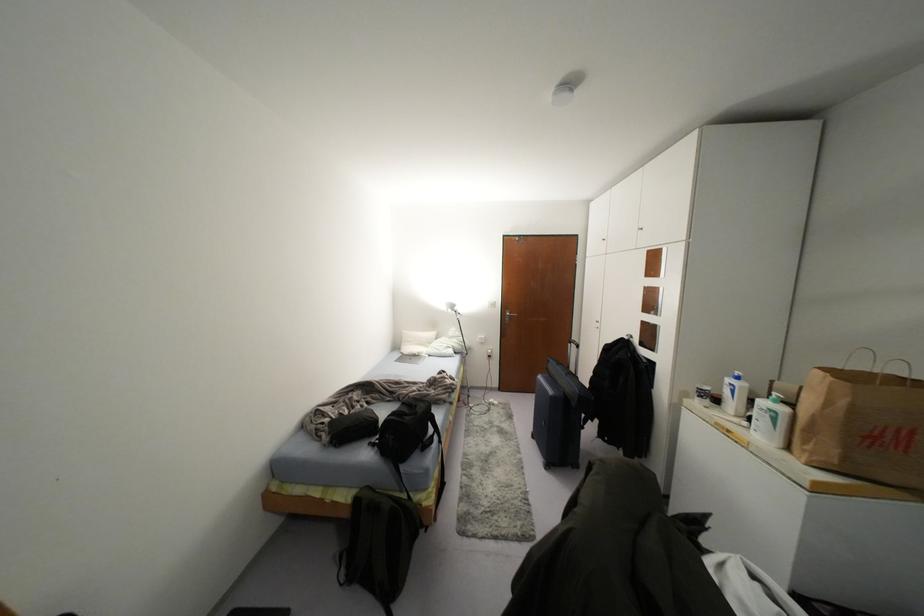
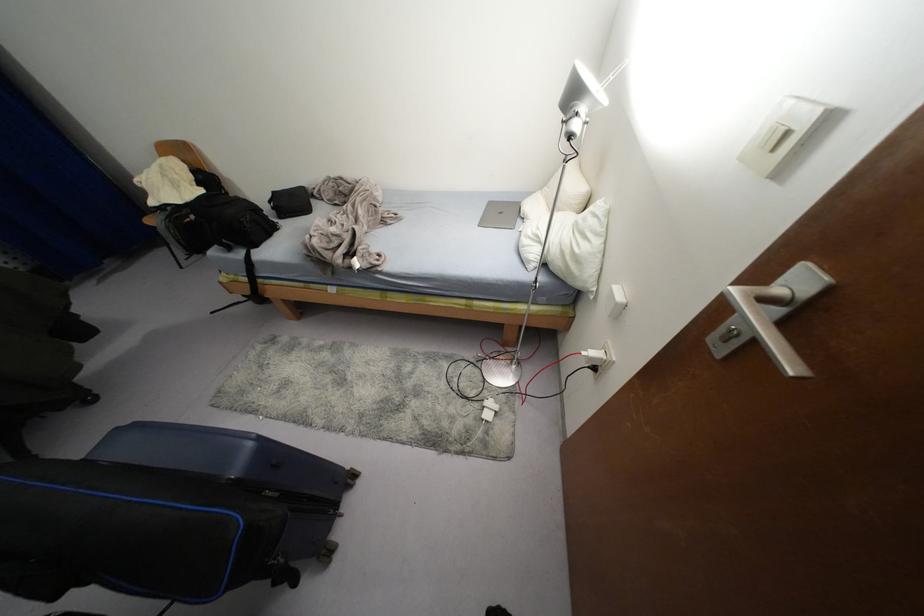
Find the pixel in the second image that matches [489,351] in the first image.

(592, 353)